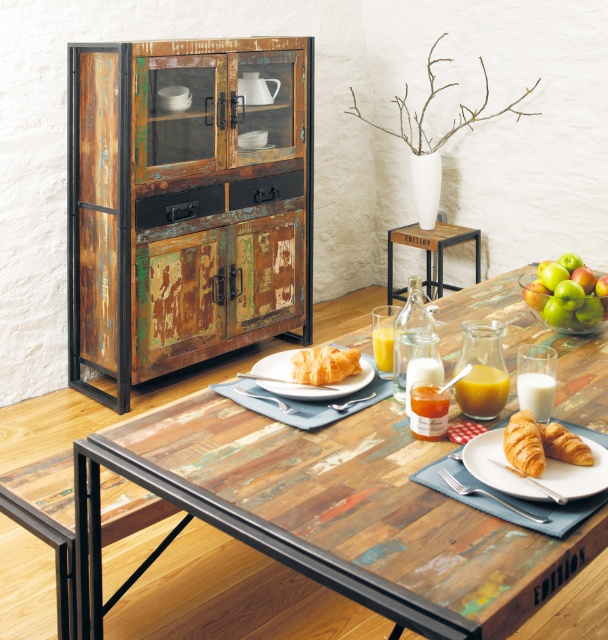
Who is shorter, green matte apples at upper right or translucent glass bottle at center?

translucent glass bottle at center

Does green matte apples at upper right come in front of translucent glass bottle at center?

No, green matte apples at upper right is further to the viewer.

The height and width of the screenshot is (640, 608). Describe the element at coordinates (564, 296) in the screenshot. I see `green matte apples at upper right` at that location.

Where is `green matte apples at upper right`? green matte apples at upper right is located at coordinates (564, 296).

Which is more to the right, wooden table at center or translucent glass bottle at table right?

translucent glass bottle at table right is more to the right.

This screenshot has width=608, height=640. What are the coordinates of `wooden table at center` in the screenshot? It's located at (330, 515).

Where is `wooden table at center`? Image resolution: width=608 pixels, height=640 pixels. wooden table at center is located at coordinates (330, 515).

Who is higher up, translucent glass bottle at center or golden flaky croissant at lower right?

translucent glass bottle at center

From the picture: Who is more distant from viewer, [437,397] or [545,444]?

The point [437,397] is behind.

Is point (446, 422) positioned after point (575, 445)?

Yes, it is.

You are a GUI agent. You are given a task and a screenshot of the screen. Output one action in this format:
    pyautogui.click(x=<x>, y=<y>)
    Task: Click on the translucent glass bottle at center
    The width and height of the screenshot is (608, 640).
    Given the screenshot: What is the action you would take?
    pyautogui.click(x=427, y=410)